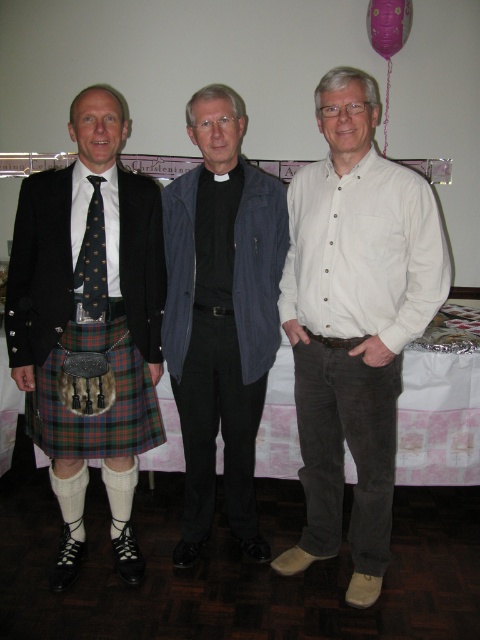
Question: Does white cloth at lower center have a smaller size compared to dark blue dotted tie at left?

Choices:
 (A) yes
 (B) no

Answer: (B)

Question: Among these points, which one is farthest from the camera?

Choices:
 (A) (136, 428)
 (B) (17, 390)
 (C) (87, 234)

Answer: (B)

Question: Which object is positioned closest to the white button-down shirt at center?

Choices:
 (A) dark blue dotted tie at left
 (B) white cloth at lower center
 (C) dark blue corduroy jacket at center

Answer: (C)

Question: Which of the following is the farthest from the observer?

Choices:
 (A) purple paper balloon at upper right
 (B) dark blue corduroy jacket at center
 (C) white button-down shirt at center
 (D) dark blue dotted tie at left

Answer: (A)

Question: Is plaidknit fabrickilt at left wider than white cloth at lower center?

Choices:
 (A) no
 (B) yes

Answer: (A)

Question: Observing the image, what is the correct spatial positioning of white cloth at lower center in reference to tartan fabric kilt at left?

Choices:
 (A) right
 (B) left

Answer: (A)